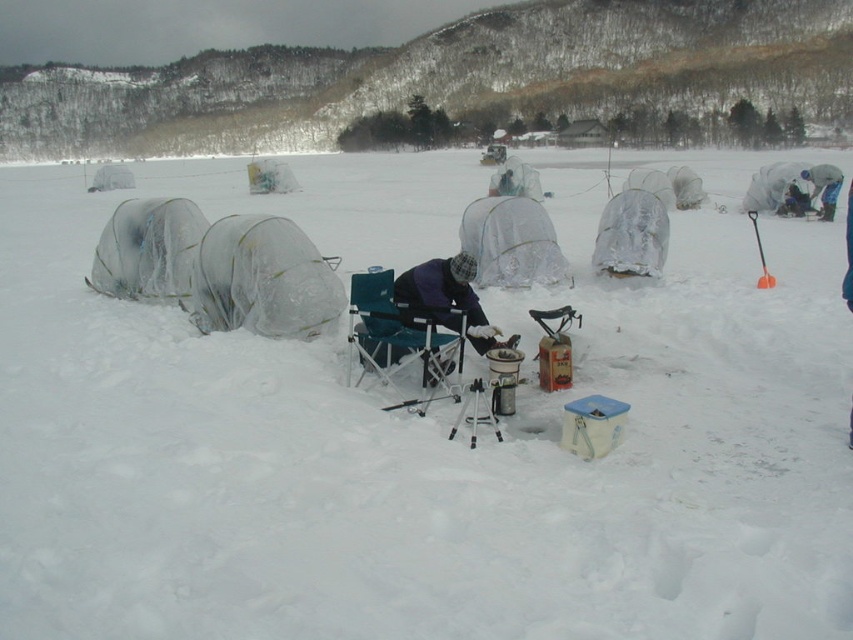
Who is shorter, teal fabric folding chair at center or transparent plastic tent at center?

With less height is teal fabric folding chair at center.

Is teal fabric folding chair at center shorter than transparent plastic tent at center?

Correct, teal fabric folding chair at center is not as tall as transparent plastic tent at center.

Image resolution: width=853 pixels, height=640 pixels. Identify the location of teal fabric folding chair at center. (402, 339).

The height and width of the screenshot is (640, 853). Identify the location of teal fabric folding chair at center. (402, 339).

What do you see at coordinates (402, 339) in the screenshot? The image size is (853, 640). I see `teal fabric folding chair at center` at bounding box center [402, 339].

Is point (434, 374) positioned in front of point (811, 176)?

Yes.

You are a GUI agent. You are given a task and a screenshot of the screen. Output one action in this format:
    pyautogui.click(x=<x>, y=<y>)
    Task: Click on the teal fabric folding chair at center
    
    Given the screenshot: What is the action you would take?
    pyautogui.click(x=402, y=339)

Image resolution: width=853 pixels, height=640 pixels. Describe the element at coordinates (402, 339) in the screenshot. I see `teal fabric folding chair at center` at that location.

Is point (354, 289) positioned in front of point (447, 266)?

Yes, point (354, 289) is closer to viewer.

This screenshot has width=853, height=640. What are the coordinates of `teal fabric folding chair at center` in the screenshot? It's located at (402, 339).